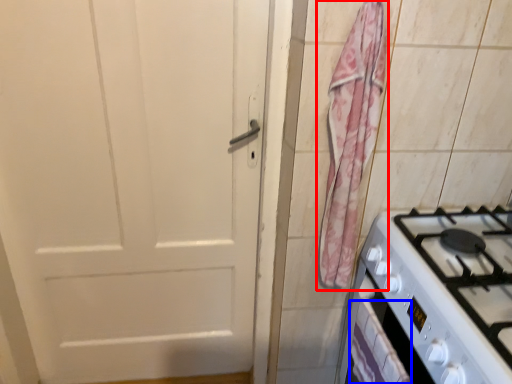
Question: Which of the following is the closest to the observer, curtain (highlighted by a red box) or drawer (highlighted by a blue box)?

Choices:
 (A) curtain
 (B) drawer

Answer: (B)